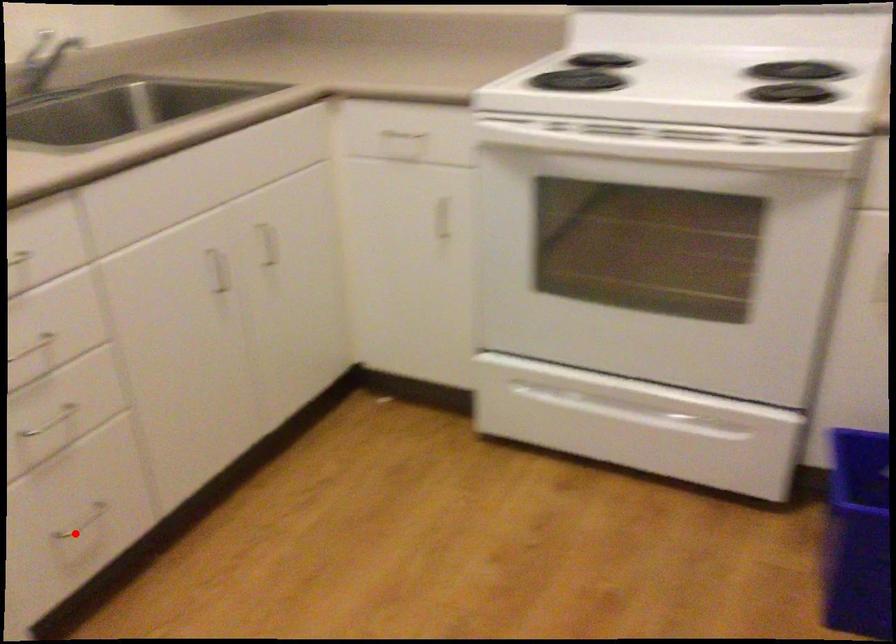
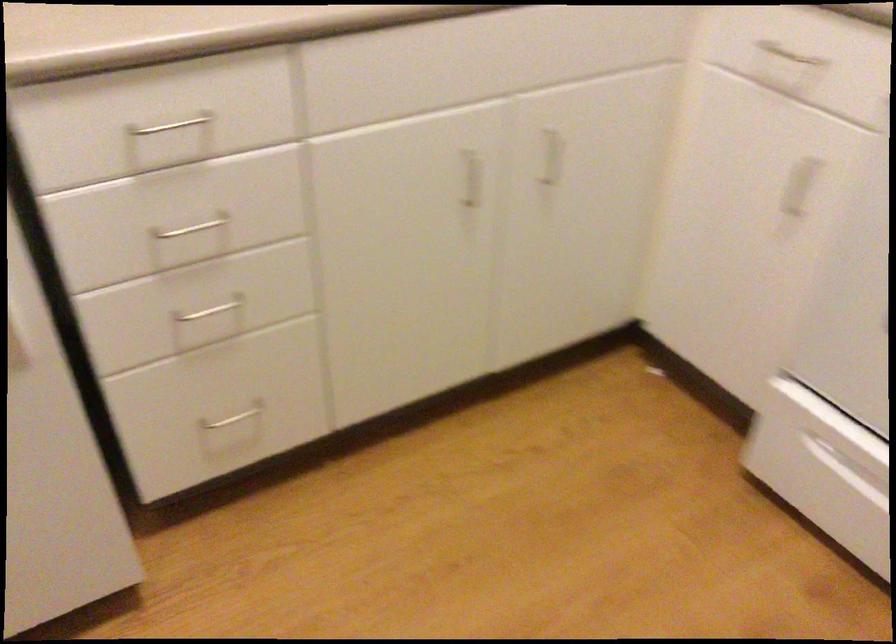
In the second image, find the point that corresponds to the highlighted location in the first image.

(231, 419)